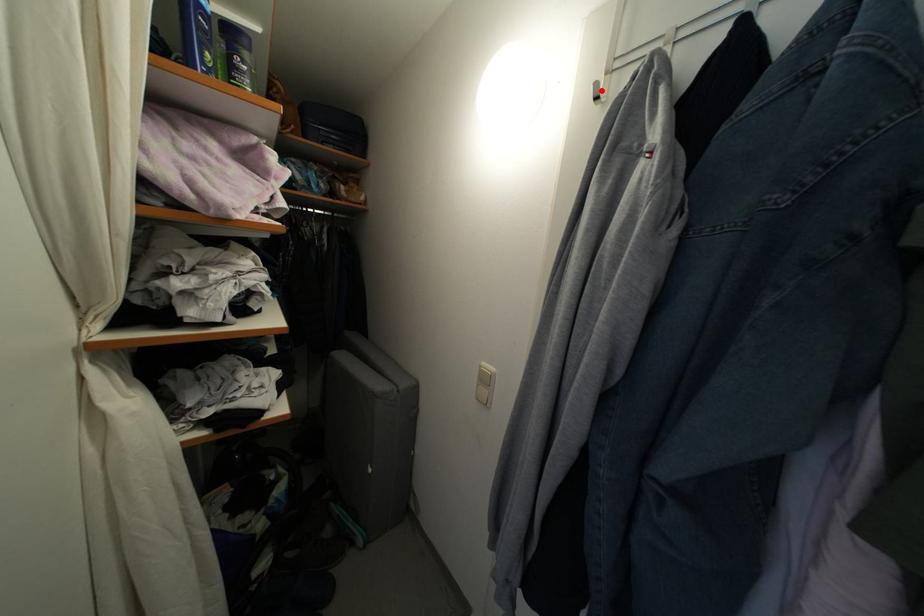
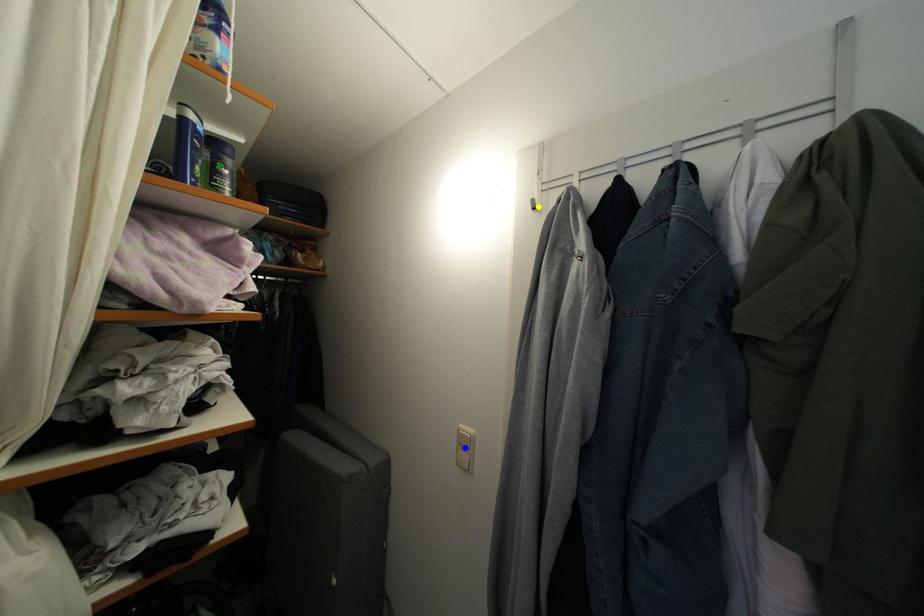
Question: I am providing you with two images of the same scene from different viewpoints. A red point is marked on the first image. You are given multiple points on the second image. Which point in image 2 is actually the same real-world point as the red point in image 1?

Choices:
 (A) green point
 (B) blue point
 (C) yellow point

Answer: (C)